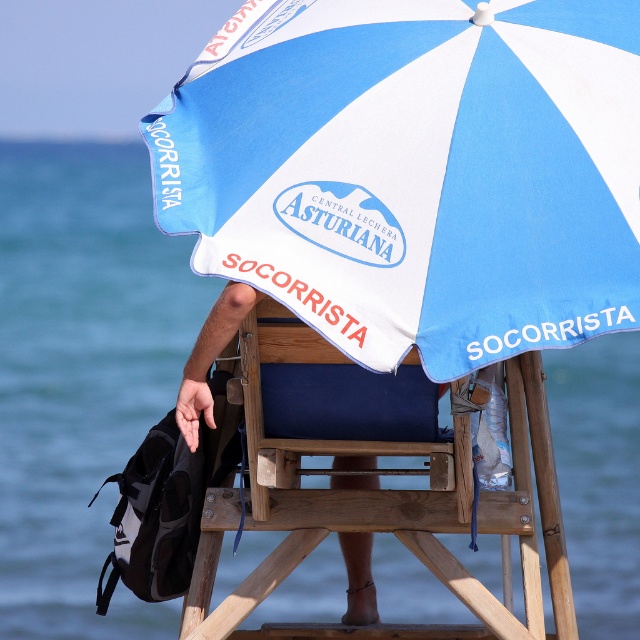
You are a beachgoer who wants to stay under the shade. You see the blue fabric umbrella at center and the wooden at center. Which one provides shade?

The blue fabric umbrella at center is positioned over wooden at center, so the blue fabric umbrella at center provides shade over the wooden at center.

You are a drone operator tasked with capturing aerial footage of the beach scene. The lifeguard station is your main subject. To ensure the blue fabric umbrella at center is centered in the frame, what coordinates should you aim for?

The blue fabric umbrella at center is located at coordinates (413, 170), so aim your drone camera at those coordinates to center it in the frame.